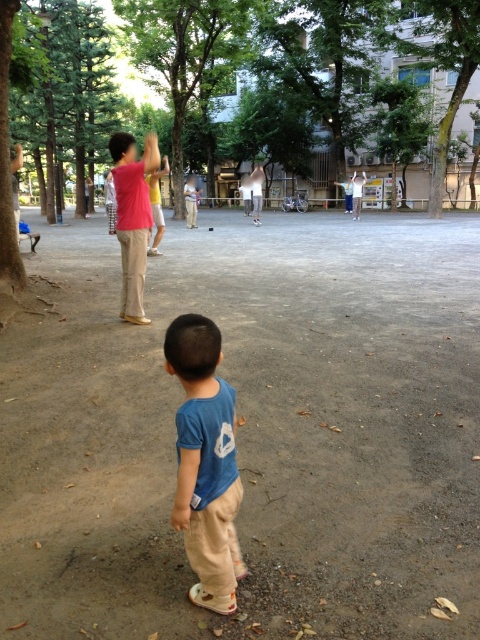
Question: Among these objects, which one is farthest from the camera?

Choices:
 (A) green leafy tree at upper center
 (B) light brown wood bench at center
 (C) brown dirt field at center
 (D) blue cotton shirt at center

Answer: (B)

Question: Is blue cotton shirt at center positioned in front of light brown wood bench at center?

Choices:
 (A) no
 (B) yes

Answer: (B)

Question: Which point appears closest to the camera in this image?

Choices:
 (A) (139, 13)
 (B) (351, 189)
 (C) (93, 380)
 (D) (195, 435)

Answer: (D)

Question: In this image, where is green leafy tree at upper center located relative to blue cotton shirt at center?

Choices:
 (A) left
 (B) right

Answer: (B)

Question: Does green leafy tree at upper center come behind light brown wood bench at center?

Choices:
 (A) no
 (B) yes

Answer: (A)

Question: Which object is the closest to the blue cotton shirt at center?

Choices:
 (A) brown dirt field at center
 (B) green leafy tree at upper center

Answer: (A)